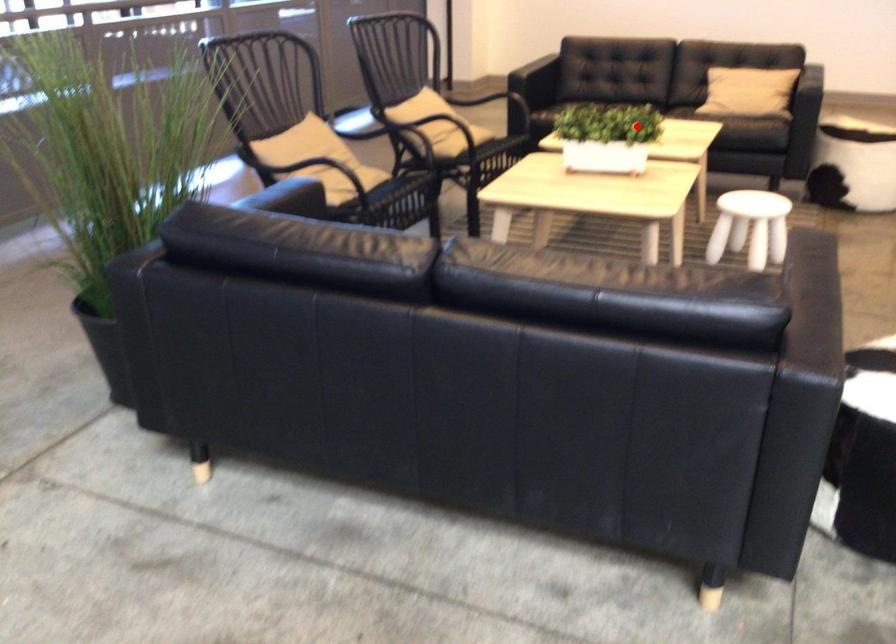
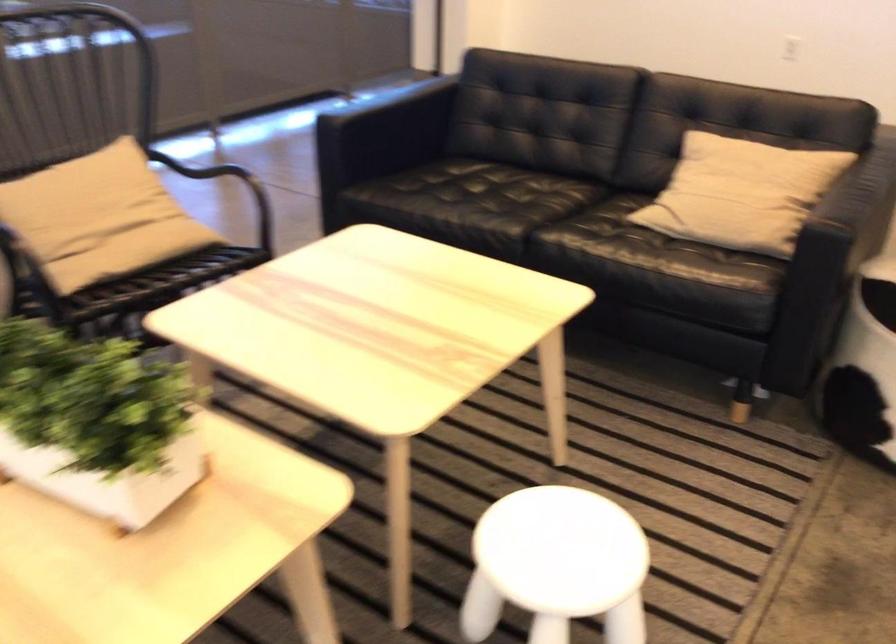
Question: I am providing you with two images of the same scene from different viewpoints. A red point is marked on the first image. At the location where the point appears in image 1, is it still visible in image 2?

Choices:
 (A) Yes
 (B) No

Answer: (A)